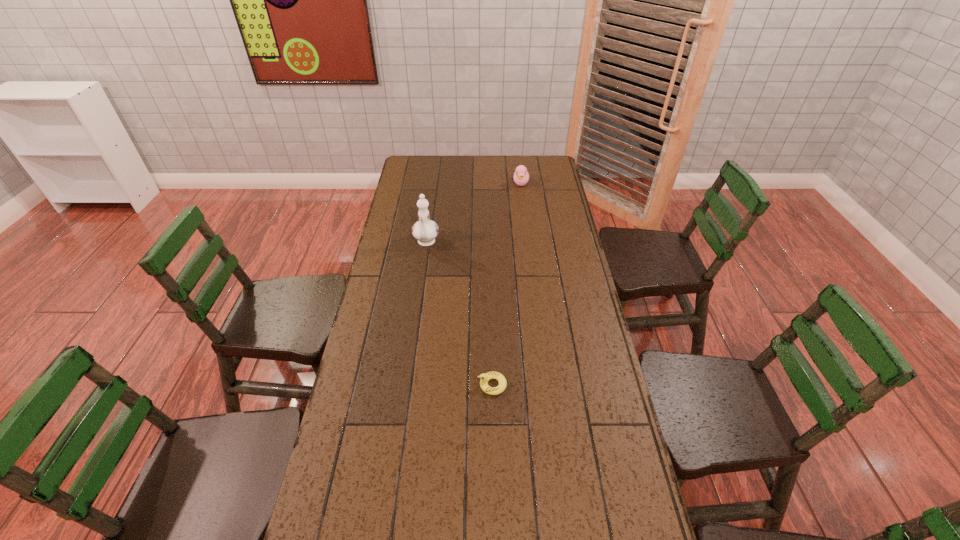
Identify the location of vacant space located 0.160m on the face of the second object from left to right. The height and width of the screenshot is (540, 960). (423, 385).

I want to click on object that is at the far edge, so click(521, 176).

Locate an element on the screen. This screenshot has height=540, width=960. object that is at the left edge is located at coordinates (425, 230).

This screenshot has height=540, width=960. Find the location of `object that is at the right edge`. object that is at the right edge is located at coordinates (521, 176).

You are a GUI agent. You are given a task and a screenshot of the screen. Output one action in this format:
    pyautogui.click(x=<x>, y=<y>)
    Task: Click on the object located at the far right corner
    The image size is (960, 540).
    Given the screenshot: What is the action you would take?
    pyautogui.click(x=521, y=176)

You are a GUI agent. You are given a task and a screenshot of the screen. Output one action in this format:
    pyautogui.click(x=<x>, y=<y>)
    Task: Click on the vacant space at the far edge of the desktop
    
    Given the screenshot: What is the action you would take?
    pyautogui.click(x=517, y=158)

Locate an element on the screen. blank space at the left edge of the desktop is located at coordinates (376, 467).

In the image, there is a desktop. In order to click on vacant space at the right edge in this screenshot , I will do `click(556, 248)`.

In the image, there is a desktop. At what (x,y) coordinates should I click in order to perform the action: click on vacant space at the far left corner. Please return your answer as a coordinate pair (x, y). This screenshot has width=960, height=540. Looking at the image, I should click on (435, 166).

This screenshot has height=540, width=960. I want to click on vacant space in between the second tallest object and the leftmost object, so click(x=473, y=213).